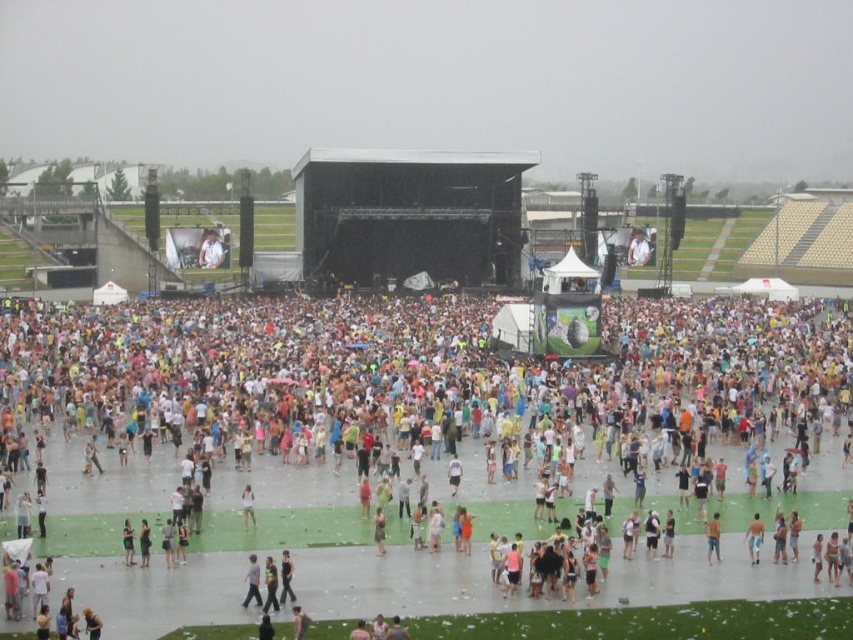
You are a photographer at the concert and want to take a photo of both the light brown leather jacket at center and the white matte dress at center. Which one is taller so that you can adjust your camera angle accordingly?

The light brown leather jacket at center is taller than the white matte dress at center, so you should adjust your camera angle to focus on the height difference between them.